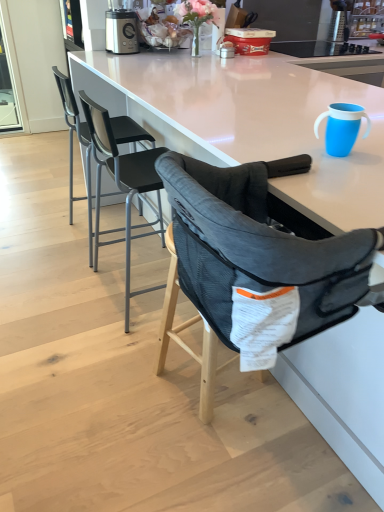
Locate an element on the screen. This screenshot has width=384, height=512. vacant region to the left of black mesh chair at center, the second chair in the back-to-front sequence is located at coordinates (51, 289).